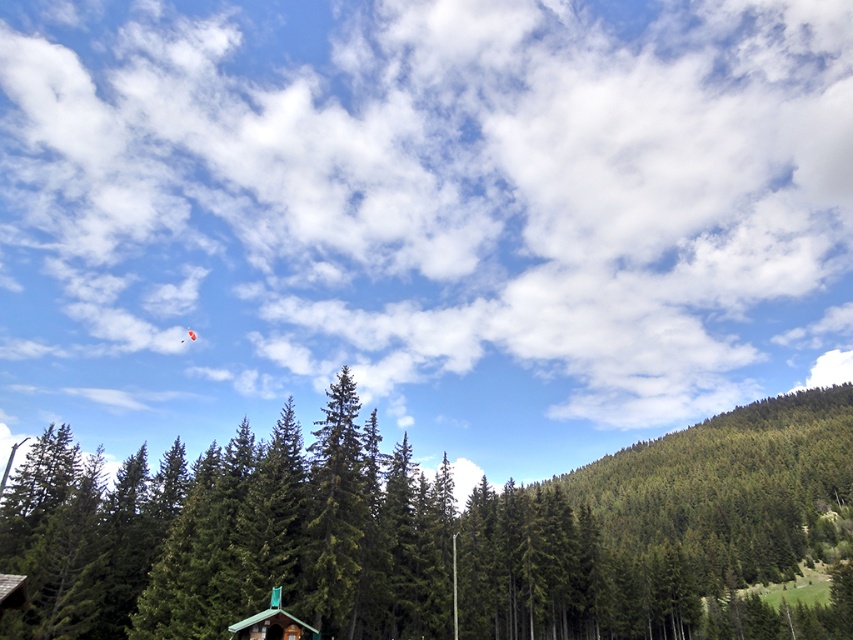
Question: Which object is farther from the camera taking this photo?

Choices:
 (A) green matte tree at center
 (B) green matte cabin at lower center

Answer: (B)

Question: Does green matte tree at center appear on the right side of green matte cabin at lower center?

Choices:
 (A) yes
 (B) no

Answer: (A)

Question: Which of the following is the farthest from the observer?

Choices:
 (A) green matte tree at center
 (B) green matte cabin at lower center

Answer: (B)

Question: Does green matte tree at center have a larger size compared to green matte cabin at lower center?

Choices:
 (A) yes
 (B) no

Answer: (A)

Question: In this image, where is green matte tree at center located relative to green matte cabin at lower center?

Choices:
 (A) above
 (B) below

Answer: (B)